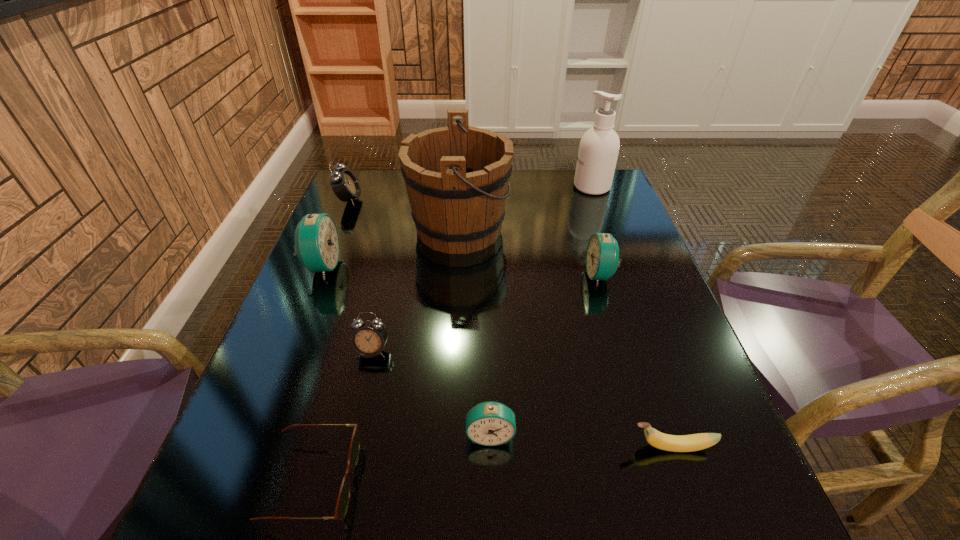
I want to click on cleansing agent, so click(x=598, y=151).

The width and height of the screenshot is (960, 540). Identify the location of wine bucket. (457, 177).

At what (x,y) coordinates should I click in order to perform the action: click on the tallest alarm clock. Please return your answer as a coordinate pair (x, y). The height and width of the screenshot is (540, 960). Looking at the image, I should click on (317, 245).

Identify the location of the leftmost blue alarm clock. Image resolution: width=960 pixels, height=540 pixels. (317, 245).

Locate an element on the screen. This screenshot has height=540, width=960. the farthest alarm clock is located at coordinates (345, 185).

Identify the location of the farther white alarm clock. click(x=345, y=185).

This screenshot has width=960, height=540. Identify the location of the second biggest blue alarm clock. (602, 256).

I want to click on the rightmost alarm clock, so click(602, 256).

Image resolution: width=960 pixels, height=540 pixels. What are the coordinates of `the smaller white alarm clock` in the screenshot? It's located at (369, 337).

Image resolution: width=960 pixels, height=540 pixels. Find the location of `the sixth farthest object`. the sixth farthest object is located at coordinates (369, 337).